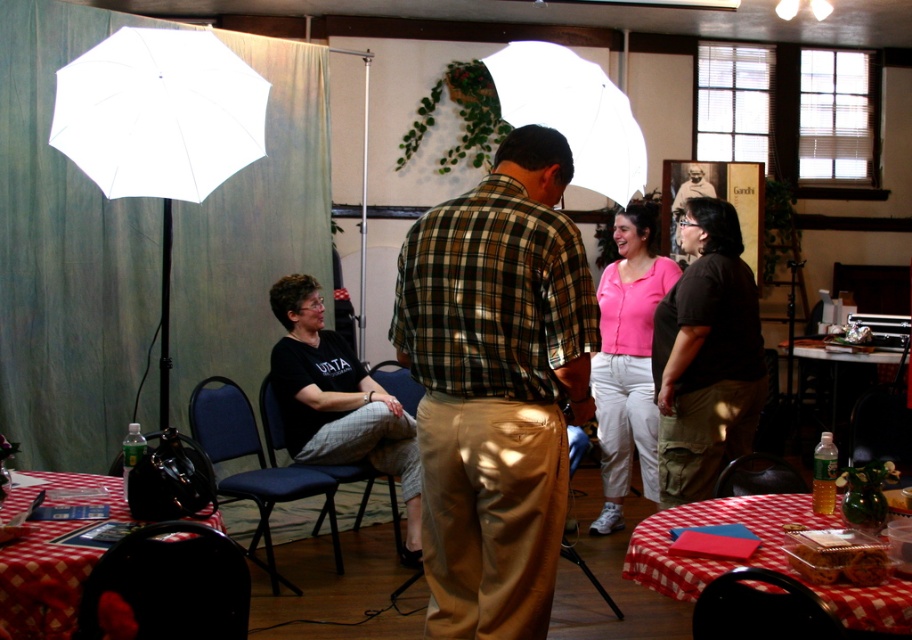
Can you confirm if white matte umbrella at upper left is positioned above black cotton shirt at center?

Yes.

Does point (168, 81) lie behind point (713, 353)?

No.

Where is `white matte umbrella at upper left`? Image resolution: width=912 pixels, height=640 pixels. white matte umbrella at upper left is located at coordinates point(159,113).

Is white fabric umbrella at center shorter than black plastic chair at lower center?

No, white fabric umbrella at center is not shorter than black plastic chair at lower center.

Is white fabric umbrella at center further to the viewer compared to black plastic chair at lower center?

Yes, it is.

Between point (545, 81) and point (785, 605), which one is positioned in front?

Point (785, 605) is in front.

The width and height of the screenshot is (912, 640). What are the coordinates of `white fabric umbrella at center` in the screenshot? It's located at (573, 113).

Does white fabric umbrella at center come behind red checkered tablecloth at lower right?

Yes.

Is point (541, 113) behind point (665, 586)?

Yes, it is behind point (665, 586).

Measure the distance between white fabric umbrella at center and camera.

white fabric umbrella at center and camera are 3.03 meters apart from each other.

Locate an element on the screen. white fabric umbrella at center is located at coordinates (573, 113).